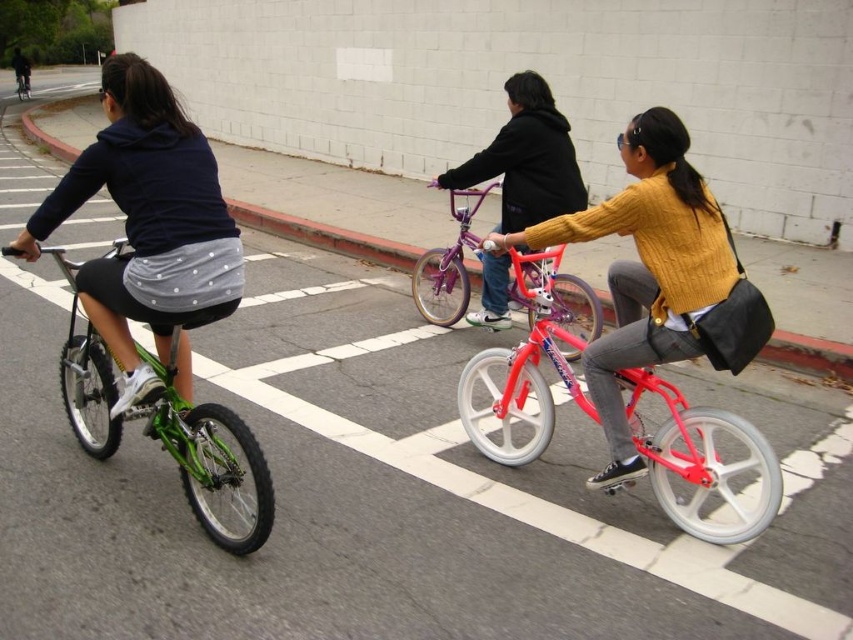
Who is more distant from viewer, (672,390) or (256,452)?

Point (672,390)

Can you confirm if shiny pink bicycle at center is positioned above green matte bicycle at left?

Indeed, shiny pink bicycle at center is positioned over green matte bicycle at left.

Identify the location of shiny pink bicycle at center. The width and height of the screenshot is (853, 640). (703, 465).

I want to click on shiny pink bicycle at center, so click(x=703, y=465).

Looking at this image, can you confirm if matte black hoodie at upper left is positioned above matte yellow sweater at center?

No, matte black hoodie at upper left is not above matte yellow sweater at center.

Is matte black hoodie at upper left thinner than matte yellow sweater at center?

Correct, matte black hoodie at upper left's width is less than matte yellow sweater at center's.

You are a GUI agent. You are given a task and a screenshot of the screen. Output one action in this format:
    pyautogui.click(x=<x>, y=<y>)
    Task: Click on the matte black hoodie at upper left
    Image resolution: width=853 pixels, height=640 pixels.
    Given the screenshot: What is the action you would take?
    pyautogui.click(x=148, y=227)

This screenshot has height=640, width=853. I want to click on matte black hoodie at upper left, so click(x=148, y=227).

Is matte black hoodie at upper left shorter than shiny pink bicycle at center?

Yes.

Looking at this image, is matte black hoodie at upper left behind shiny pink bicycle at center?

That is True.

Find the location of a particular element. This screenshot has height=640, width=853. matte black hoodie at upper left is located at coordinates (148, 227).

Identify the location of matte black hoodie at upper left. (148, 227).